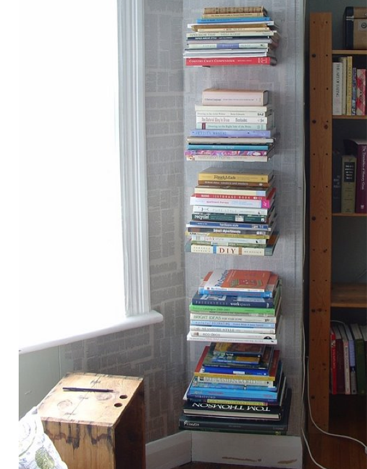
At what (x,y) coordinates should I click in order to perform the action: click on stack of books on the shelf below the top shelf. Please return your answer as a coordinate pair (x, y). The height and width of the screenshot is (469, 367). Looking at the image, I should click on (232, 128), (238, 309).